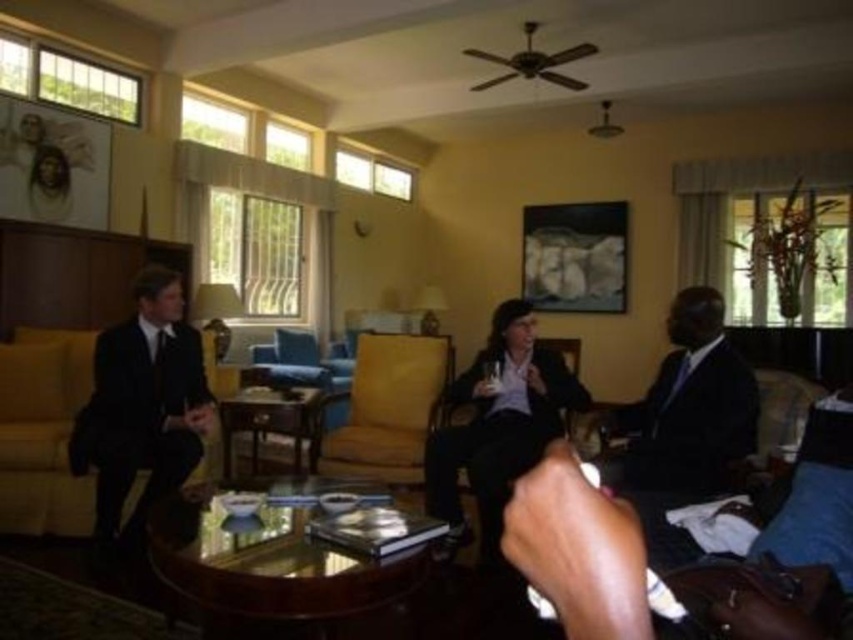
Is matte black couch at left positioned behind matte black armchair at center?

Yes, it is behind matte black armchair at center.

Is matte black couch at left above matte black armchair at center?

Yes.

What are the coordinates of `matte black couch at left` in the screenshot? It's located at (44, 433).

Can you confirm if matte black armchair at center is positioned to the left of yellow fabric armchair at center?

No, matte black armchair at center is not to the left of yellow fabric armchair at center.

Is matte black armchair at center bigger than yellow fabric armchair at center?

Correct, matte black armchair at center is larger in size than yellow fabric armchair at center.

Where is `matte black armchair at center`? This screenshot has width=853, height=640. matte black armchair at center is located at coordinates (497, 435).

In the scene shown: Is matte black suit at right bigger than yellow fabric armchair at center?

Actually, matte black suit at right might be smaller than yellow fabric armchair at center.

Can you confirm if matte black suit at right is positioned to the left of yellow fabric armchair at center?

No, matte black suit at right is not to the left of yellow fabric armchair at center.

What do you see at coordinates (689, 406) in the screenshot?
I see `matte black suit at right` at bounding box center [689, 406].

Locate an element on the screen. matte black suit at right is located at coordinates (689, 406).